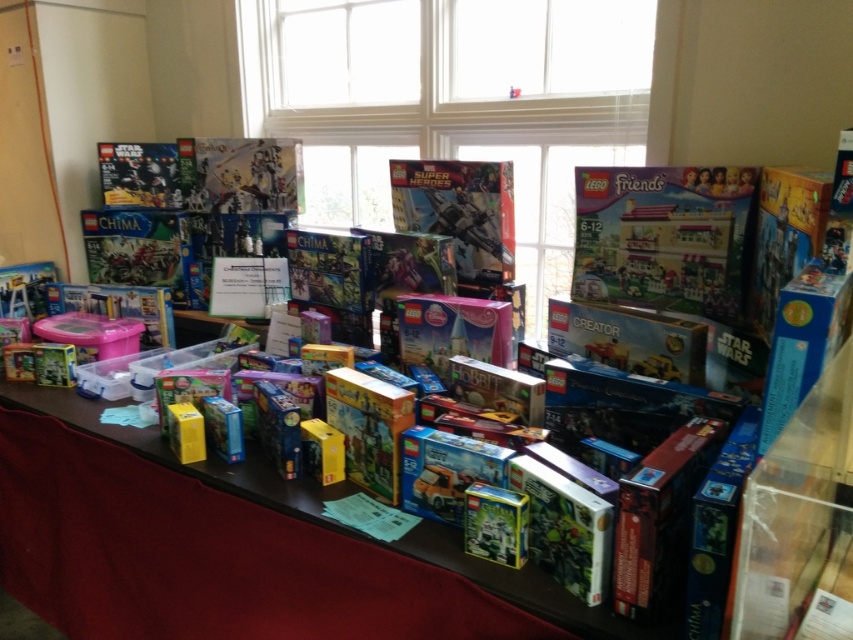
Is point (254, 140) closer to viewer compared to point (456, 214)?

No, (254, 140) is behind (456, 214).

Is matte plastic comic book at center behind metallic silver spaceship at center?

That is True.

Locate an element on the screen. The height and width of the screenshot is (640, 853). matte plastic comic book at center is located at coordinates (241, 173).

This screenshot has width=853, height=640. Find the location of `matte plastic comic book at center`. matte plastic comic book at center is located at coordinates (241, 173).

Is matte plastic lego friends set at center-right thinner than wooden table at center?

Correct, matte plastic lego friends set at center-right's width is less than wooden table at center's.

Can you confirm if matte plastic lego friends set at center-right is taller than wooden table at center?

Indeed, matte plastic lego friends set at center-right has a greater height compared to wooden table at center.

Locate an element on the screen. matte plastic lego friends set at center-right is located at coordinates (664, 237).

Can you confirm if matte plastic toy at center is positioned above metallic silver spaceship at center?

Yes, matte plastic toy at center is above metallic silver spaceship at center.

Who is more forward, (460,269) or (432,204)?

Point (460,269) is in front.

Between point (440, 195) and point (494, 250), which one is positioned behind?

Positioned behind is point (440, 195).

Locate an element on the screen. matte plastic toy at center is located at coordinates (459, 211).